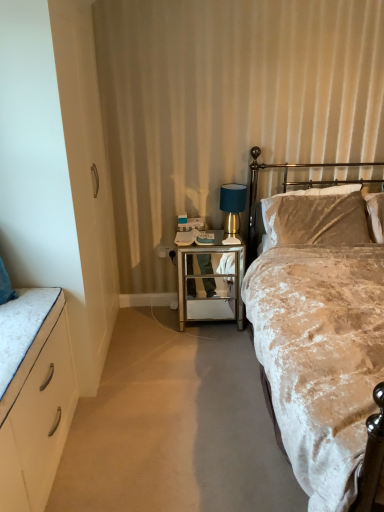
Question: In the image, is teal fabric lampshade at right on the left side or the right side of velvet beige bed at right?

Choices:
 (A) right
 (B) left

Answer: (B)

Question: From a real-world perspective, is teal fabric lampshade at right physically located above or below velvet beige bed at right?

Choices:
 (A) above
 (B) below

Answer: (A)

Question: Estimate the real-world distances between objects in this image. Which object is closer to the gold metallic headboard at upper right?

Choices:
 (A) black plastic power outlet at center
 (B) white matte cabinet at left
 (C) mirrored glass side table at center
 (D) teal fabric lampshade at right
 (E) velvet beige bed at right

Answer: (D)

Question: Considering the real-world distances, which object is closest to the black plastic power outlet at center?

Choices:
 (A) velvet beige bed at right
 (B) mirrored glass side table at center
 (C) teal fabric lampshade at right
 (D) white matte cabinet at left
 (E) gold metallic headboard at upper right

Answer: (B)